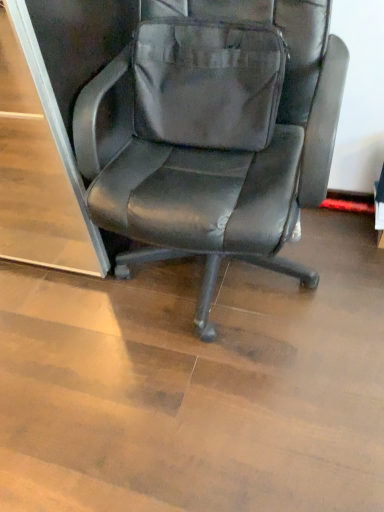
Question: Is matte gray messenger bag at center facing away from black leather chair at center?

Choices:
 (A) yes
 (B) no

Answer: (A)

Question: Is the depth of matte gray messenger bag at center greater than that of black leather chair at center?

Choices:
 (A) yes
 (B) no

Answer: (A)

Question: Is matte gray messenger bag at center with black leather chair at center?

Choices:
 (A) yes
 (B) no

Answer: (A)

Question: Does matte gray messenger bag at center have a smaller size compared to black leather chair at center?

Choices:
 (A) no
 (B) yes

Answer: (B)

Question: From a real-world perspective, is matte gray messenger bag at center under black leather chair at center?

Choices:
 (A) yes
 (B) no

Answer: (B)

Question: Is matte gray messenger bag at center not inside black leather chair at center?

Choices:
 (A) yes
 (B) no

Answer: (B)

Question: Is black leather chair at center positioned in front of matte gray messenger bag at center?

Choices:
 (A) yes
 (B) no

Answer: (A)

Question: Considering the relative positions of black leather chair at center and matte gray messenger bag at center in the image provided, is black leather chair at center behind matte gray messenger bag at center?

Choices:
 (A) no
 (B) yes

Answer: (A)

Question: From the image's perspective, would you say black leather chair at center is positioned over matte gray messenger bag at center?

Choices:
 (A) yes
 (B) no

Answer: (B)

Question: Can you confirm if black leather chair at center is thinner than matte gray messenger bag at center?

Choices:
 (A) yes
 (B) no

Answer: (B)

Question: Is black leather chair at center at the left side of matte gray messenger bag at center?

Choices:
 (A) yes
 (B) no

Answer: (B)

Question: Is black leather chair at center taller than matte gray messenger bag at center?

Choices:
 (A) no
 (B) yes

Answer: (B)

Question: Choose the correct answer: Is matte gray messenger bag at center inside black leather chair at center or outside it?

Choices:
 (A) outside
 (B) inside

Answer: (B)